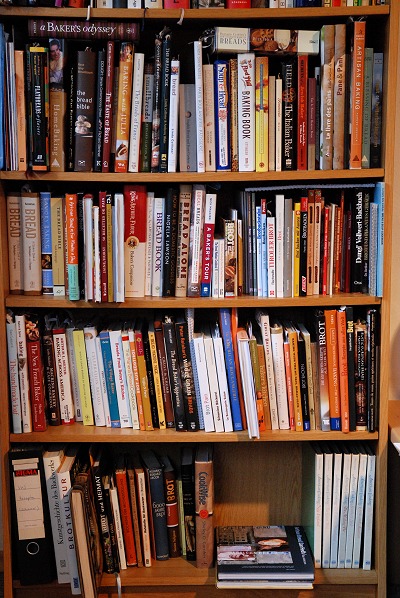
Where is `book laying flat`? book laying flat is located at coordinates coord(114,38), coord(277,39), coord(356,188), coord(280,573), coord(277,590).